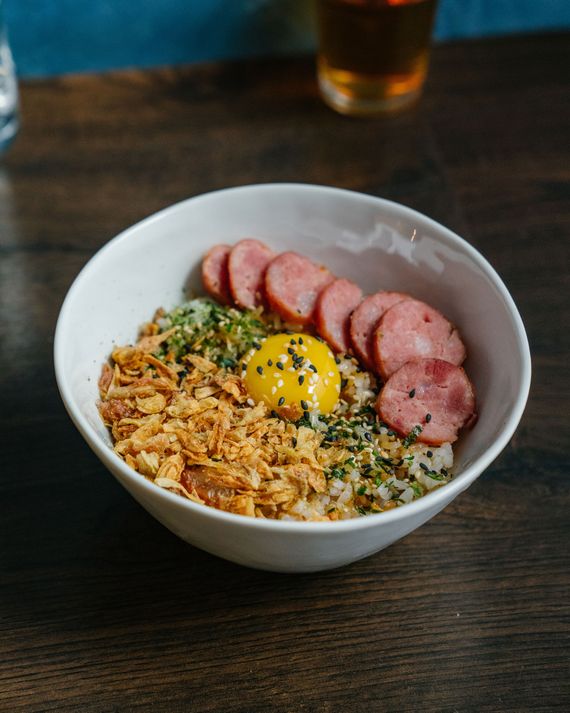
Identify the location of blue wall. This screenshot has width=570, height=713. (69, 56).